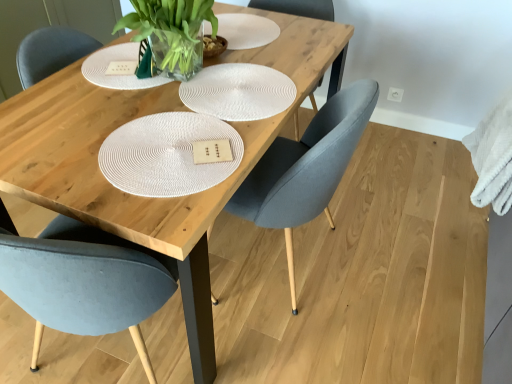
The image size is (512, 384). What do you see at coordinates (143, 197) in the screenshot? I see `wooden table at center` at bounding box center [143, 197].

Describe the element at coordinates (85, 282) in the screenshot. This screenshot has height=384, width=512. I see `matte gray chair at center, marked as the 2th chair in a right-to-left arrangement` at that location.

Measure the distance between matte gray chair at center, marked as the 2th chair in a right-to-left arrangement, and camera.

matte gray chair at center, marked as the 2th chair in a right-to-left arrangement, and camera are 31.45 inches apart from each other.

What do you see at coordinates (493, 158) in the screenshot?
I see `white fluffy towel at right` at bounding box center [493, 158].

Where is `wooden table at center`? This screenshot has width=512, height=384. wooden table at center is located at coordinates (143, 197).

Which of these two, matte gray chair at center, which is counted as the 1th chair, starting from the right, or white fluffy towel at right, stands shorter?

white fluffy towel at right is shorter.

From the image's perspective, would you say matte gray chair at center, which is counted as the 1th chair, starting from the right, is shown under white fluffy towel at right?

Yes.

Find the location of a particular element. Image resolution: width=512 pixels, height=384 pixels. cloth located behind the matte gray chair at center, which is counted as the 1th chair, starting from the right is located at coordinates (493, 158).

Which of these two, wooden table at center or white fluffy towel at right, is smaller?

Smaller between the two is white fluffy towel at right.

Which of these two, wooden table at center or white fluffy towel at right, is wider?

Wider between the two is wooden table at center.

From the picture: Considering the relative sizes of wooden table at center and white fluffy towel at right in the image provided, is wooden table at center shorter than white fluffy towel at right?

No.

From the image's perspective, is wooden table at center below white fluffy towel at right?

Yes, from the image's perspective, wooden table at center is below white fluffy towel at right.

Is white woven placemat at center smaller than matte gray chair at center, which appears as the 2th chair when viewed from the left?

Indeed, white woven placemat at center has a smaller size compared to matte gray chair at center, which appears as the 2th chair when viewed from the left.

Is matte gray chair at center, which is counted as the 1th chair, starting from the right, inside white woven placemat at center?

Actually, matte gray chair at center, which is counted as the 1th chair, starting from the right, is outside white woven placemat at center.

Which is more to the right, white woven placemat at center or matte gray chair at center, which is counted as the 1th chair, starting from the right?

Positioned to the right is matte gray chair at center, which is counted as the 1th chair, starting from the right.

Could you measure the distance between white woven placemat at center and matte gray chair at center, which is counted as the 1th chair, starting from the right?

28.05 centimeters.

Is white woven placemat at center at the right side of white fluffy towel at right?

No, white woven placemat at center is not to the right of white fluffy towel at right.

I want to click on cloth located below the white woven placemat at center (from the image's perspective), so click(493, 158).

From the image's perspective, which is below, white woven placemat at center or white fluffy towel at right?

white fluffy towel at right is shown below in the image.

Is white woven placemat at center looking in the opposite direction of white fluffy towel at right?

white woven placemat at center does not have its back to white fluffy towel at right.

From a real-world perspective, which is physically above, matte gray chair at center, which appears as the 2th chair when viewed from the left, or white woven placemat at center?

white woven placemat at center, from a real-world perspective.

From the image's perspective, is matte gray chair at center, which is counted as the 1th chair, starting from the right, located above white woven placemat at center?

No, from the image's perspective, matte gray chair at center, which is counted as the 1th chair, starting from the right, is not over white woven placemat at center.

Is the depth of matte gray chair at center, which appears as the 2th chair when viewed from the left, greater than that of white woven placemat at center?

No, it is in front of white woven placemat at center.

From a real-world perspective, is matte gray chair at center, marked as the 2th chair in a right-to-left arrangement, on top of wooden table at center?

Yes, from a real-world perspective, matte gray chair at center, marked as the 2th chair in a right-to-left arrangement, is over wooden table at center

Could you tell me if matte gray chair at center, marked as the 2th chair in a right-to-left arrangement, is facing wooden table at center?

Yes, matte gray chair at center, marked as the 2th chair in a right-to-left arrangement, is facing wooden table at center.

Is matte gray chair at center, marked as the 2th chair in a right-to-left arrangement, at the left side of wooden table at center?

Indeed, matte gray chair at center, marked as the 2th chair in a right-to-left arrangement, is positioned on the left side of wooden table at center.

From their relative heights in the image, would you say matte gray chair at center, marked as the 2th chair in a right-to-left arrangement, is taller or shorter than wooden table at center?

Considering their sizes, matte gray chair at center, marked as the 2th chair in a right-to-left arrangement, has more height than wooden table at center.

In terms of size, does white fluffy towel at right appear bigger or smaller than matte gray chair at center, which ranks as the 1th chair in left-to-right order?

Clearly, white fluffy towel at right is smaller in size than matte gray chair at center, which ranks as the 1th chair in left-to-right order.

Is there a large distance between white fluffy towel at right and matte gray chair at center, which ranks as the 1th chair in left-to-right order?

Yes.

From the image's perspective, is white fluffy towel at right positioned above or below matte gray chair at center, which ranks as the 1th chair in left-to-right order?

white fluffy towel at right is situated higher than matte gray chair at center, which ranks as the 1th chair in left-to-right order, in the image.

Consider the image. What's the angular difference between white fluffy towel at right and matte gray chair at center, marked as the 2th chair in a right-to-left arrangement,'s facing directions?

The angle between the facing direction of white fluffy towel at right and the facing direction of matte gray chair at center, marked as the 2th chair in a right-to-left arrangement, is 98.1 degrees.

At what (x,y) coordinates should I click in order to perform the action: click on chair that is the 1st object to the left of the white fluffy towel at right, starting at the anchor. Please return your answer as a coordinate pair (x, y). The width and height of the screenshot is (512, 384). Looking at the image, I should click on click(x=306, y=168).

Locate an element on the screen. table that is below the white fluffy towel at right (from the image's perspective) is located at coordinates (143, 197).

From the image, which object appears to be farther from white woven placemat at center, matte gray chair at center, which is counted as the 1th chair, starting from the right, or matte gray chair at center, which ranks as the 1th chair in left-to-right order?

matte gray chair at center, which ranks as the 1th chair in left-to-right order, is positioned further to the anchor white woven placemat at center.

Estimate the real-world distances between objects in this image. Which object is further from wooden table at center, matte gray chair at center, which is counted as the 1th chair, starting from the right, or white woven placemat at center?

matte gray chair at center, which is counted as the 1th chair, starting from the right.

When comparing their distances from matte gray chair at center, which appears as the 2th chair when viewed from the left, does wooden table at center or white fluffy towel at right seem further?

white fluffy towel at right is further to matte gray chair at center, which appears as the 2th chair when viewed from the left.

Which object lies nearer to the anchor point matte gray chair at center, which appears as the 2th chair when viewed from the left, white woven placemat at center or white fluffy towel at right?

Based on the image, white woven placemat at center appears to be nearer to matte gray chair at center, which appears as the 2th chair when viewed from the left.

Which object lies nearer to the anchor point wooden table at center, matte gray chair at center, which appears as the 2th chair when viewed from the left, or matte gray chair at center, marked as the 2th chair in a right-to-left arrangement?

matte gray chair at center, which appears as the 2th chair when viewed from the left, is closer to wooden table at center.

Looking at this image, when comparing their distances from white woven placemat at center, does wooden table at center or matte gray chair at center, which ranks as the 1th chair in left-to-right order, seem closer?

wooden table at center is positioned closer to the anchor white woven placemat at center.

From the picture: Considering their positions, is matte gray chair at center, which ranks as the 1th chair in left-to-right order, positioned closer to white woven placemat at center than wooden table at center?

wooden table at center lies closer to white woven placemat at center than the other object.

Looking at the image, which one is located further to matte gray chair at center, marked as the 2th chair in a right-to-left arrangement, wooden table at center or white woven placemat at center?

white woven placemat at center is positioned further to the anchor matte gray chair at center, marked as the 2th chair in a right-to-left arrangement.

This screenshot has height=384, width=512. In order to click on table between matte gray chair at center, marked as the 2th chair in a right-to-left arrangement, and matte gray chair at center, which is counted as the 1th chair, starting from the right in this screenshot , I will do `click(143, 197)`.

At what (x,y) coordinates should I click in order to perform the action: click on table between white woven placemat at center and matte gray chair at center, marked as the 2th chair in a right-to-left arrangement, from top to bottom. Please return your answer as a coordinate pair (x, y). This screenshot has width=512, height=384. Looking at the image, I should click on (143, 197).

The image size is (512, 384). I want to click on plate situated between matte gray chair at center, marked as the 2th chair in a right-to-left arrangement, and matte gray chair at center, which appears as the 2th chair when viewed from the left, from left to right, so click(238, 92).

Identify the location of plate between wooden table at center and matte gray chair at center, which appears as the 2th chair when viewed from the left, in the horizontal direction. (238, 92).